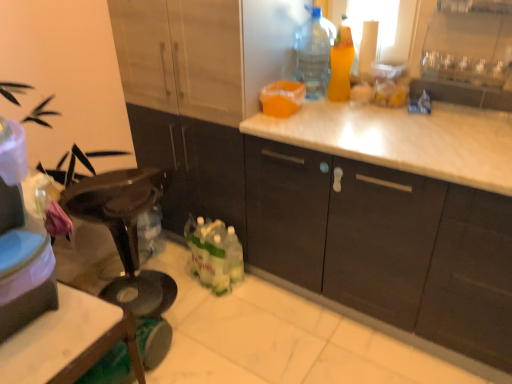
Question: Looking at the image, does matte wood cabinets at center seem bigger or smaller compared to translucent orange spray bottle at upper right, marked as the 1th bottle in a right-to-left arrangement?

Choices:
 (A) small
 (B) big

Answer: (B)

Question: Visually, is matte wood cabinets at center positioned to the left or to the right of translucent orange spray bottle at upper right, marked as the second bottle in a left-to-right arrangement?

Choices:
 (A) right
 (B) left

Answer: (A)

Question: Estimate the real-world distances between objects in this image. Which object is closer to the translucent orange spray bottle at upper right, marked as the second bottle in a left-to-right arrangement?

Choices:
 (A) transparent plastic bottle at upper right, the 1th bottle from the left
 (B) matte plastic container at left
 (C) matte wood cabinets at center

Answer: (A)

Question: Which is farther from the matte wood cabinets at center?

Choices:
 (A) translucent orange spray bottle at upper right, marked as the second bottle in a left-to-right arrangement
 (B) matte plastic container at left
 (C) transparent plastic bottle at upper right, the 2th bottle positioned from the right

Answer: (B)